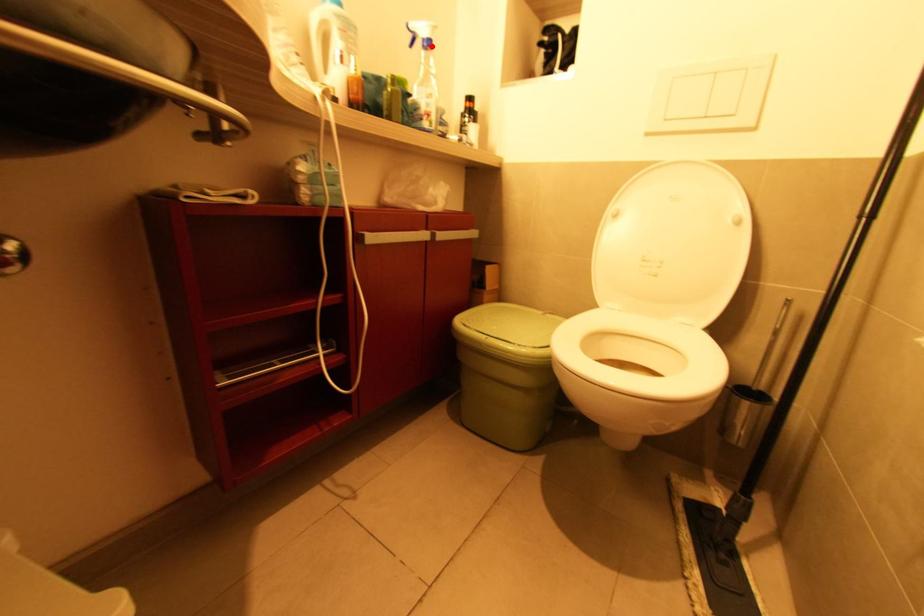
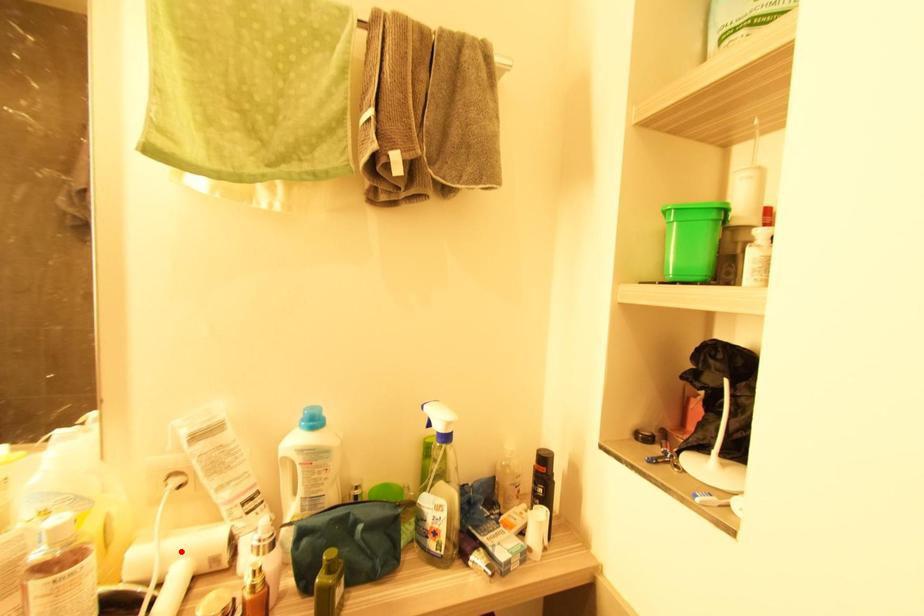
I am providing you with two images of the same scene from different viewpoints. A red point is marked on the first image and another point is marked on the second image. Do the highlighted points in image1 and image2 indicate the same real-world spot?

No